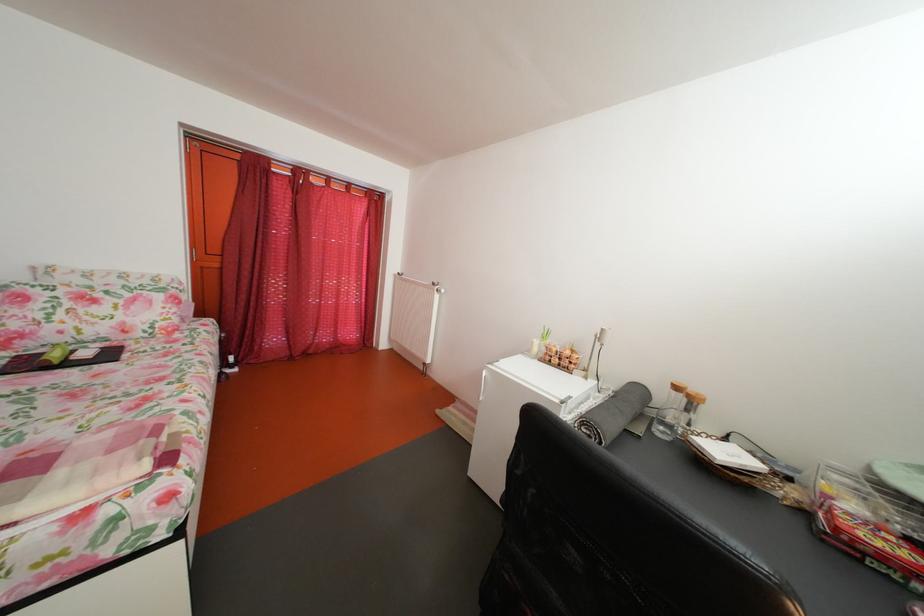
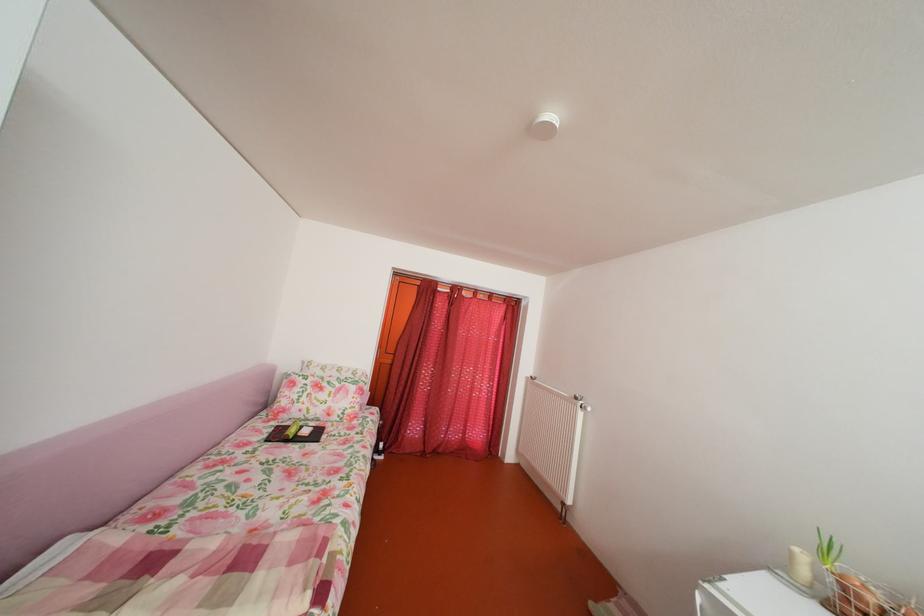
The point at (444, 291) is marked in the first image. Where is the corresponding point in the second image?

(588, 405)